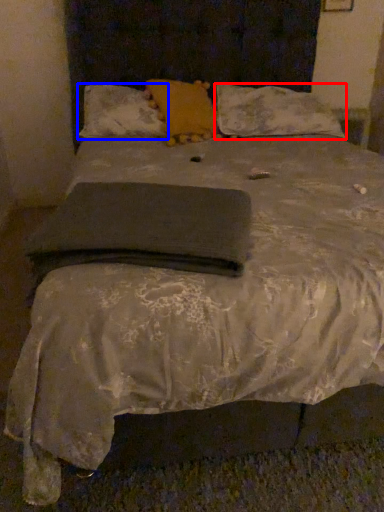
Question: Which object appears closest to the camera in this image, pillow (highlighted by a red box) or pillow (highlighted by a blue box)?

Choices:
 (A) pillow
 (B) pillow

Answer: (B)